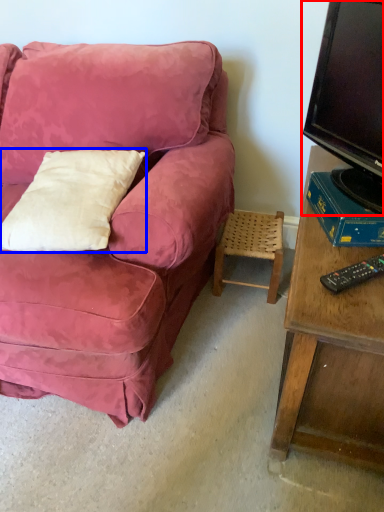
Question: Which object appears farthest to the camera in this image, television (highlighted by a red box) or pillow (highlighted by a blue box)?

Choices:
 (A) television
 (B) pillow

Answer: (B)